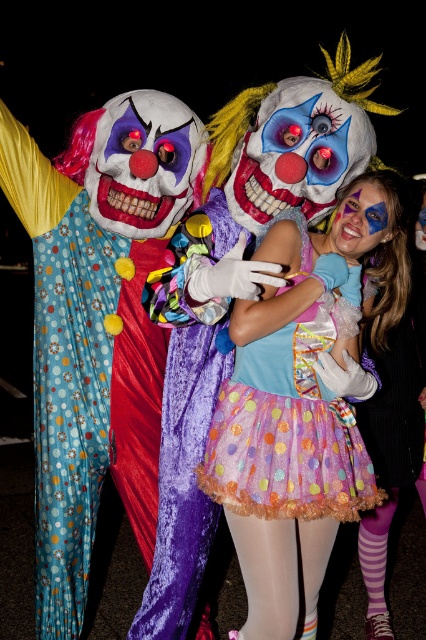
You are standing in a room and want to hand a small gift to the polka dot fabric clown at left. The gift requires you to be within 3 meters to give it properly. Can you successfully hand over the gift without moving closer?

The polka dot fabric clown at left and viewer are 2.54 meters apart from each other, so yes, you can successfully hand over the gift without moving closer since the distance is within the 3 meters requirement.

You are standing in the middle of the room and want to move towards the polka dot fabric clown at left. Which direction should you turn to face the clown?

The polka dot fabric clown at left is located at coordinates 0.506 on the x axis and 0.228 on the y axis. Since the clown is at the left side of the image, you should turn to your left to face the polka dot fabric clown at left.

You are a photographer at the event and want to capture both the polka dot fabric clown at left and the pastel polka dot tutu at center in a single frame. Which one should you focus on first to ensure they are both in the frame?

Since the polka dot fabric clown at left is larger in size compared to the pastel polka dot tutu at center, you should focus on the polka dot fabric clown at left first to ensure both fit within the frame.